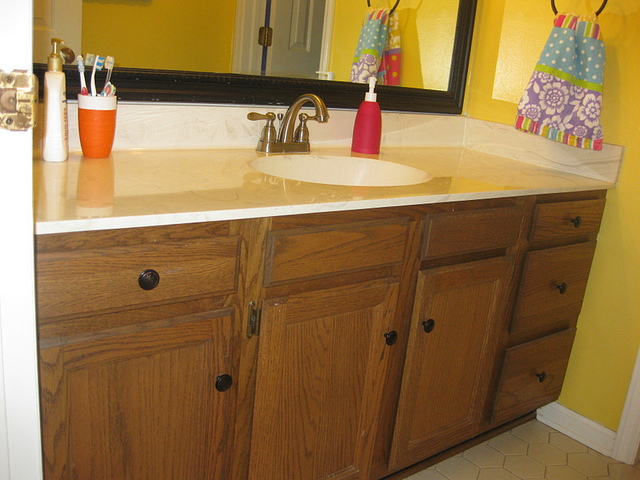
You are a GUI agent. You are given a task and a screenshot of the screen. Output one action in this format:
    pyautogui.click(x=<x>, y=<y>)
    Task: Click on the mirror
    The image size is (640, 480).
    Given the screenshot: What is the action you would take?
    pyautogui.click(x=164, y=56)